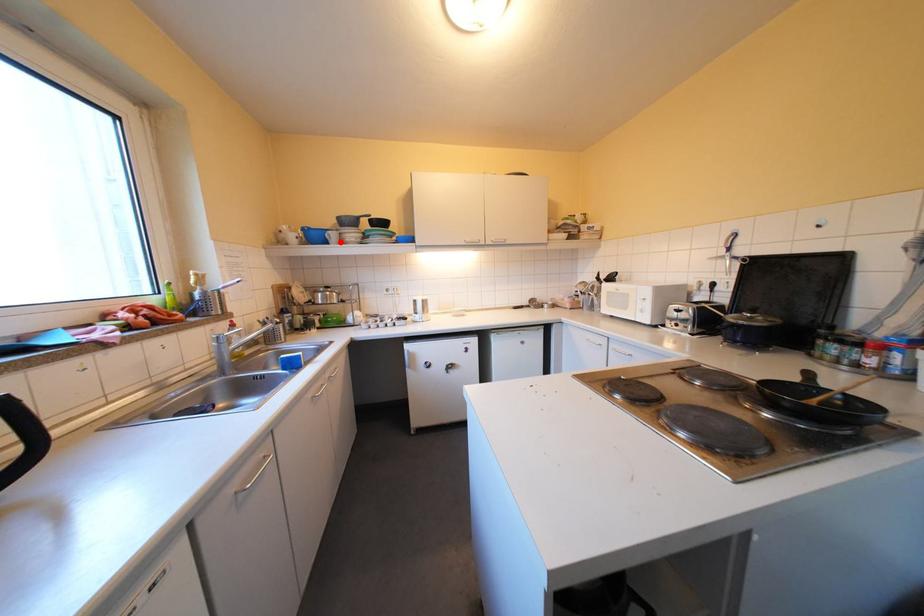
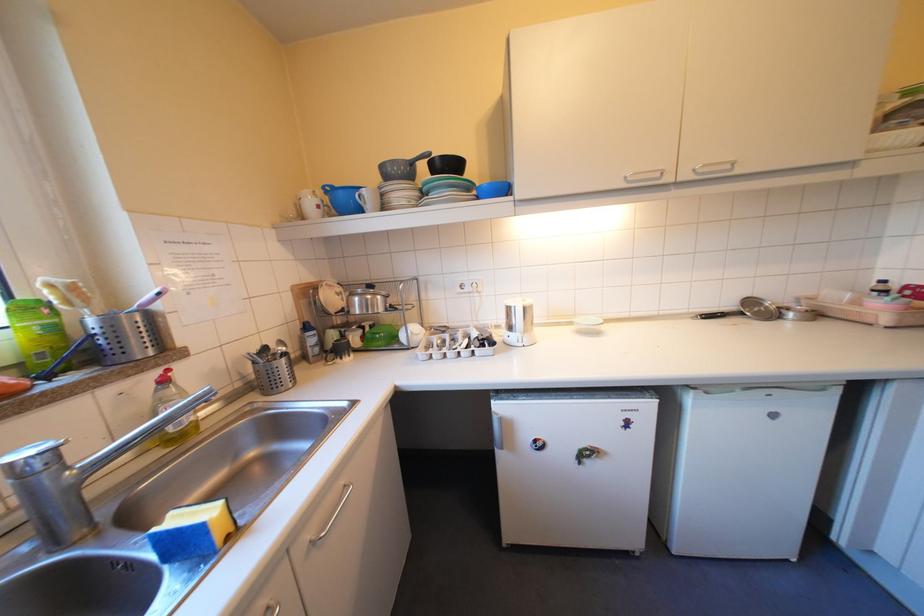
Question: I am providing you with two images of the same scene from different viewpoints. A red point is marked on the first image. Is the red point's position out of view in image 2?

Choices:
 (A) Yes
 (B) No

Answer: (B)